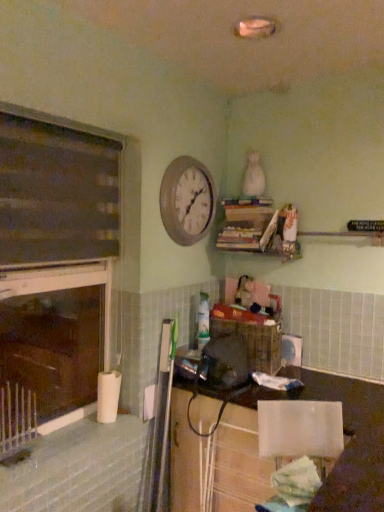
Question: Is dark wood window frame at left facing away from silver metallic radiator at lower left?

Choices:
 (A) yes
 (B) no

Answer: (A)

Question: Can you confirm if dark wood window frame at left is shorter than silver metallic radiator at lower left?

Choices:
 (A) yes
 (B) no

Answer: (B)

Question: Is silver metallic radiator at lower left surrounded by dark wood window frame at left?

Choices:
 (A) no
 (B) yes

Answer: (B)

Question: From the image's perspective, is dark wood window frame at left below silver metallic radiator at lower left?

Choices:
 (A) yes
 (B) no

Answer: (B)

Question: From a real-world perspective, does dark wood window frame at left sit lower than silver metallic radiator at lower left?

Choices:
 (A) no
 (B) yes

Answer: (A)

Question: Is the depth of dark wood window frame at left greater than that of silver metallic radiator at lower left?

Choices:
 (A) no
 (B) yes

Answer: (B)

Question: Can you confirm if wooden clock at upper center is bigger than dark wood window frame at left?

Choices:
 (A) no
 (B) yes

Answer: (A)

Question: From the image's perspective, does wooden clock at upper center appear lower than dark wood window frame at left?

Choices:
 (A) yes
 (B) no

Answer: (B)

Question: Considering the relative sizes of wooden clock at upper center and dark wood window frame at left in the image provided, is wooden clock at upper center smaller than dark wood window frame at left?

Choices:
 (A) yes
 (B) no

Answer: (A)

Question: Can you confirm if wooden clock at upper center is shorter than dark wood window frame at left?

Choices:
 (A) yes
 (B) no

Answer: (A)

Question: Considering the relative sizes of wooden clock at upper center and dark wood window frame at left in the image provided, is wooden clock at upper center thinner than dark wood window frame at left?

Choices:
 (A) no
 (B) yes

Answer: (B)

Question: Is wooden clock at upper center oriented away from dark wood window frame at left?

Choices:
 (A) no
 (B) yes

Answer: (A)

Question: Can we say dark wood window frame at left lies outside wooden clock at upper center?

Choices:
 (A) no
 (B) yes

Answer: (B)